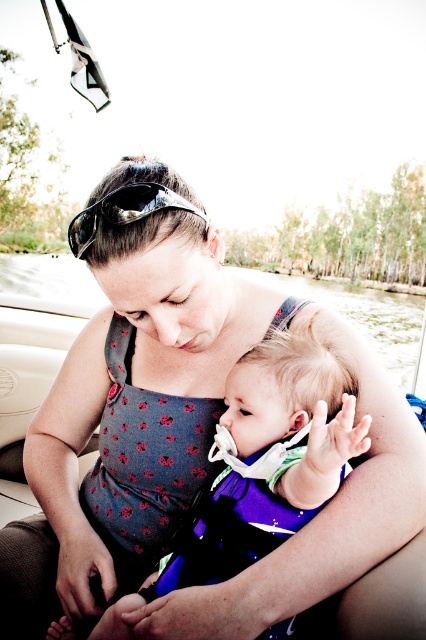
You are a photographer trying to capture the baby and the sunglasses in the image. Since both are at the center, where should you focus your camera to ensure the purple fabric baby at center is in the frame along with the shiny black sunglasses at center?

The purple fabric baby at center is positioned on the right side of shiny black sunglasses at center, so you should focus your camera on the right side of the center area to include both the purple fabric baby at center and the shiny black sunglasses at center in the frame.

You are a photographer trying to capture a closeup of the purple fabric baby at center and the shiny black sunglasses at center. Since you want both objects to be in focus, which one should you adjust your camera focus closer to?

The purple fabric baby at center is taller than the shiny black sunglasses at center, so you should adjust your camera focus closer to the shiny black sunglasses at center to ensure both are in focus.

You are a photographer standing at the edge of the boat. You want to take a closeup photo of the purple fabric baby at center. The camera requires the subject to be within 20 inches to focus properly. Can you take the photo from your current position?

The distance between the purple fabric baby at center and the camera is 21.76 inches, which is beyond the 20 inches required for proper focus. Therefore, you need to move closer to the purple fabric baby at center to take the closeup photo.